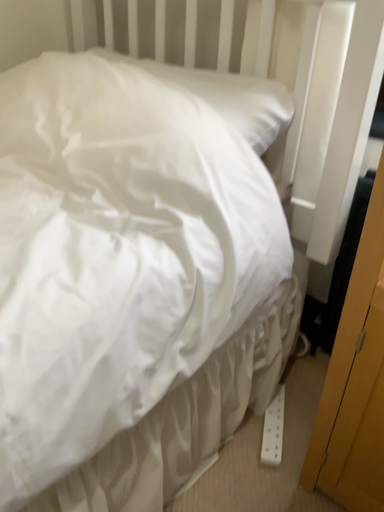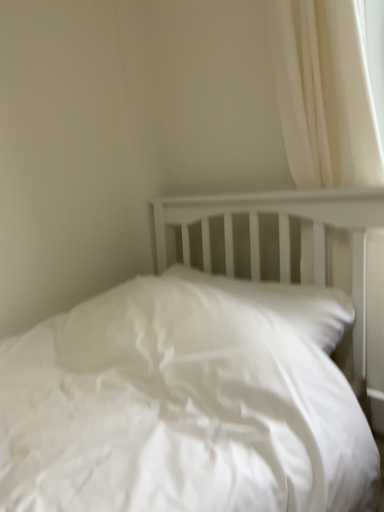
Question: How did the camera likely rotate when shooting the video?

Choices:
 (A) rotated right
 (B) rotated left

Answer: (B)